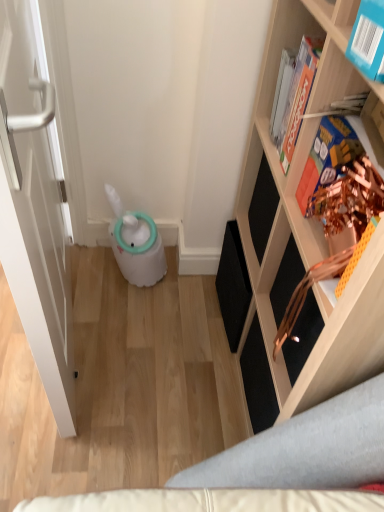
Identify the location of free space in front of white matte door at left. (64, 441).